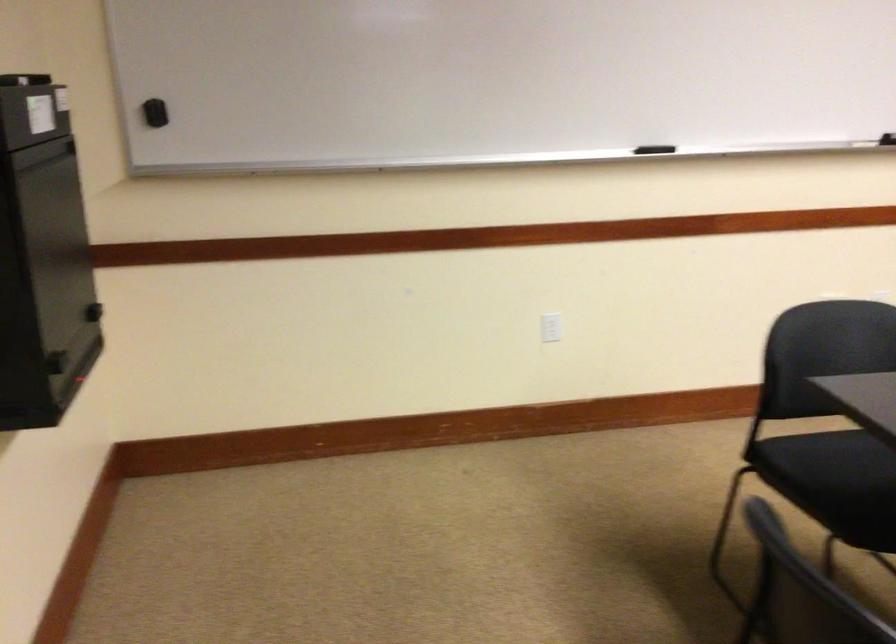
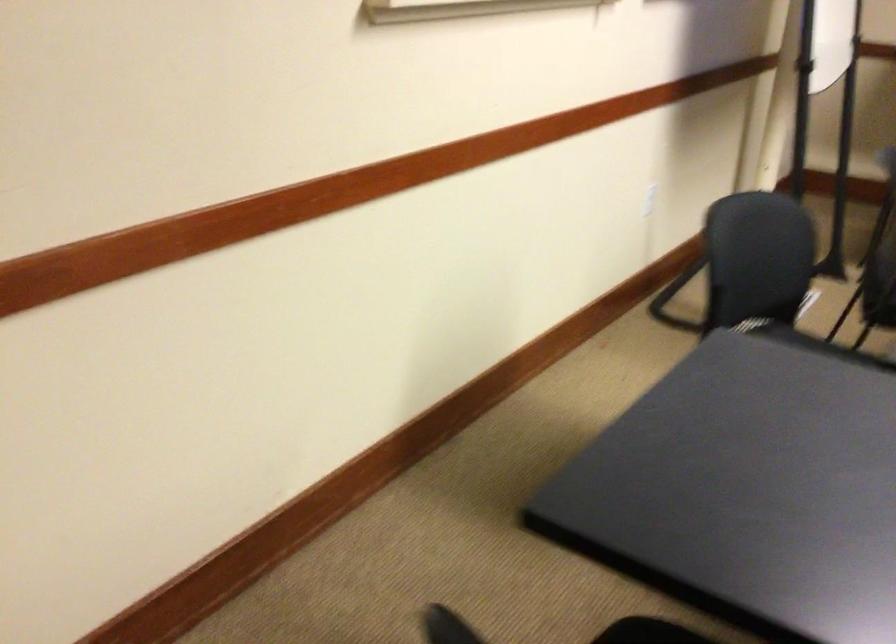
How did the camera likely rotate?

The camera's rotation is toward right-down.